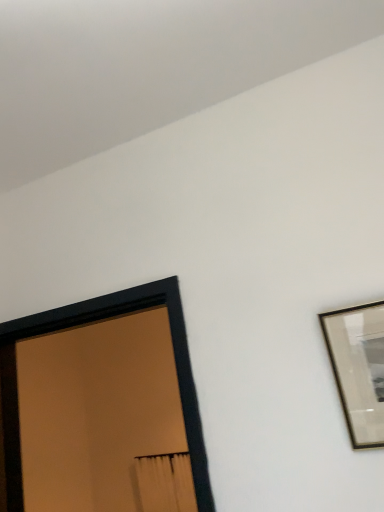
Question: In terms of height, does gold metallic picture frame at upper right, which is the second picture frame from left to right, look taller or shorter compared to black matte picture frame at left, arranged as the first picture frame when viewed from the back?

Choices:
 (A) tall
 (B) short

Answer: (B)

Question: Would you say gold metallic picture frame at upper right, placed as the 1th picture frame when sorted from front to back, is inside or outside black matte picture frame at left, arranged as the first picture frame when viewed from the back?

Choices:
 (A) inside
 (B) outside

Answer: (B)

Question: Relative to black matte picture frame at left, arranged as the first picture frame when viewed from the back, is gold metallic picture frame at upper right, placed as the 1th picture frame when sorted from front to back, in front or behind?

Choices:
 (A) behind
 (B) front

Answer: (B)

Question: From a real-world perspective, is black matte picture frame at left, arranged as the first picture frame when viewed from the back, above or below gold metallic picture frame at upper right, placed as the 1th picture frame when sorted from front to back?

Choices:
 (A) above
 (B) below

Answer: (A)

Question: In terms of height, does black matte picture frame at left, which is counted as the second picture frame, starting from the front, look taller or shorter compared to gold metallic picture frame at upper right, placed as the 1th picture frame when sorted from front to back?

Choices:
 (A) tall
 (B) short

Answer: (A)

Question: Considering the positions of point (180, 355) and point (326, 332), is point (180, 355) closer or farther from the camera than point (326, 332)?

Choices:
 (A) closer
 (B) farther

Answer: (B)

Question: From the image's perspective, is black matte picture frame at left, which is counted as the second picture frame, starting from the front, positioned above or below gold metallic picture frame at upper right, placed as the 1th picture frame when sorted from front to back?

Choices:
 (A) above
 (B) below

Answer: (B)